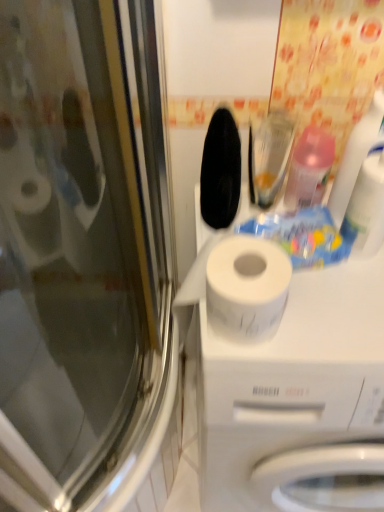
Question: Is pink translucent bottle at upper right, acting as the second cleaning product starting from the right, wider or thinner than translucent plastic spray bottle at upper right, the second cleaning product positioned from the left?

Choices:
 (A) thin
 (B) wide

Answer: (B)

Question: Is pink translucent bottle at upper right, the 1th cleaning product viewed from the left, inside or outside of translucent plastic spray bottle at upper right, which is the first cleaning product in right-to-left order?

Choices:
 (A) inside
 (B) outside

Answer: (B)

Question: Which of these objects is positioned closest to the transparent glass screen door at left?

Choices:
 (A) white matte toilet paper at center
 (B) translucent plastic spray bottle at upper right, the second cleaning product positioned from the left
 (C) pink translucent bottle at upper right, acting as the second cleaning product starting from the right

Answer: (A)

Question: Which object is positioned farthest from the white matte toilet paper at center?

Choices:
 (A) translucent plastic spray bottle at upper right, which is the first cleaning product in right-to-left order
 (B) transparent glass screen door at left
 (C) pink translucent bottle at upper right, acting as the second cleaning product starting from the right

Answer: (B)